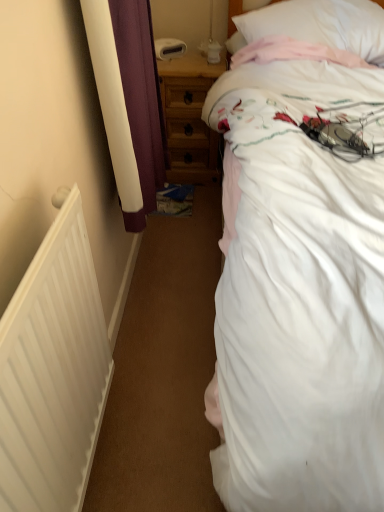
Question: Considering the relative positions of white soft pillow at upper right and white cotton bed at upper right in the image provided, is white soft pillow at upper right to the right of white cotton bed at upper right from the viewer's perspective?

Choices:
 (A) no
 (B) yes

Answer: (A)

Question: Does white soft pillow at upper right turn towards white cotton bed at upper right?

Choices:
 (A) no
 (B) yes

Answer: (B)

Question: Is white soft pillow at upper right not within white cotton bed at upper right?

Choices:
 (A) no
 (B) yes

Answer: (A)

Question: Is white soft pillow at upper right surrounding white cotton bed at upper right?

Choices:
 (A) no
 (B) yes

Answer: (A)

Question: From a real-world perspective, is white soft pillow at upper right beneath white cotton bed at upper right?

Choices:
 (A) no
 (B) yes

Answer: (A)

Question: In the image, is white matte radiator at left positioned in front of or behind white cotton bed at upper right?

Choices:
 (A) front
 (B) behind

Answer: (B)

Question: Considering the relative positions of white matte radiator at left and white cotton bed at upper right in the image provided, is white matte radiator at left to the left or to the right of white cotton bed at upper right?

Choices:
 (A) right
 (B) left

Answer: (B)

Question: From their relative heights in the image, would you say white matte radiator at left is taller or shorter than white cotton bed at upper right?

Choices:
 (A) short
 (B) tall

Answer: (A)

Question: Does point (36, 397) appear closer or farther from the camera than point (215, 303)?

Choices:
 (A) farther
 (B) closer

Answer: (B)

Question: Is point (76, 271) closer or farther from the camera than point (365, 23)?

Choices:
 (A) farther
 (B) closer

Answer: (B)

Question: From the image's perspective, is white matte radiator at left above or below white soft pillow at upper right?

Choices:
 (A) below
 (B) above

Answer: (A)

Question: Considering the relative positions of white matte radiator at left and white soft pillow at upper right in the image provided, is white matte radiator at left to the left or to the right of white soft pillow at upper right?

Choices:
 (A) right
 (B) left

Answer: (B)

Question: Relative to white soft pillow at upper right, is white matte radiator at left in front or behind?

Choices:
 (A) front
 (B) behind

Answer: (A)

Question: Is wooden nightstand at center wider or thinner than white matte radiator at left?

Choices:
 (A) wide
 (B) thin

Answer: (A)

Question: From their relative heights in the image, would you say wooden nightstand at center is taller or shorter than white matte radiator at left?

Choices:
 (A) tall
 (B) short

Answer: (B)